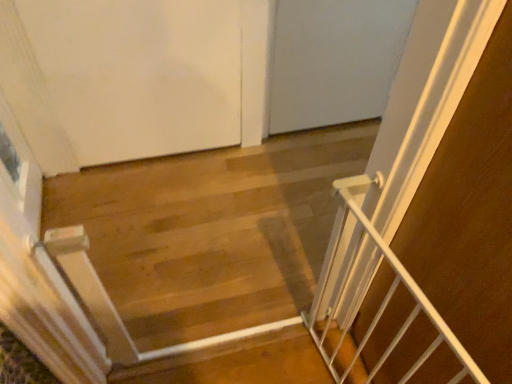
This screenshot has height=384, width=512. What do you see at coordinates (140, 73) in the screenshot? I see `white matte door at upper left` at bounding box center [140, 73].

Locate an element on the screen. white matte door at upper left is located at coordinates (140, 73).

This screenshot has height=384, width=512. Identify the location of white metal gate at right. (366, 292).

Find the location of a particular element. white matte door at upper left is located at coordinates (140, 73).

Considering the sizes of white matte door at upper left and white metal gate at center in the image, is white matte door at upper left taller or shorter than white metal gate at center?

Considering their sizes, white matte door at upper left has more height than white metal gate at center.

Image resolution: width=512 pixels, height=384 pixels. What are the coordinates of `stairwell on the right of white matte door at upper left` in the screenshot? It's located at (211, 232).

Looking at this image, how different are the orientations of white matte door at upper left and white metal gate at center in degrees?

The facing directions of white matte door at upper left and white metal gate at center are 0.723 degrees apart.

From the image's perspective, who appears lower, white matte door at upper left or white metal gate at center?

white metal gate at center, from the image's perspective.

Is white matte door at upper left oriented towards white metal gate at right?

Yes, white matte door at upper left is aimed at white metal gate at right.

Is white matte door at upper left not inside white metal gate at right?

white matte door at upper left lies outside white metal gate at right's area.

Does white matte door at upper left have a greater width compared to white metal gate at right?

No, white matte door at upper left is not wider than white metal gate at right.

Is white metal gate at right wider than white metal gate at center?

Yes, white metal gate at right is wider than white metal gate at center.

Who is more distant, white metal gate at right or white metal gate at center?

Positioned behind is white metal gate at center.

Considering the relative sizes of white metal gate at right and white metal gate at center in the image provided, is white metal gate at right bigger than white metal gate at center?

Yes, white metal gate at right is bigger than white metal gate at center.

From the image's perspective, would you say white metal gate at right is positioned over white metal gate at center?

No.

Is white metal gate at center positioned beyond the bounds of white matte door at upper left?

Yes, white metal gate at center is not within white matte door at upper left.

Is white metal gate at center looking in the opposite direction of white matte door at upper left?

Absolutely, white metal gate at center is directed away from white matte door at upper left.

How much distance is there between white metal gate at center and white matte door at upper left?

white metal gate at center and white matte door at upper left are 18.38 inches apart from each other.

The width and height of the screenshot is (512, 384). Find the location of `door lying above the white metal gate at center (from the image's perspective)`. door lying above the white metal gate at center (from the image's perspective) is located at coordinates (140, 73).

Would you say white metal gate at center contains white metal gate at right?

No, white metal gate at center does not contain white metal gate at right.

Considering the sizes of objects white metal gate at center and white metal gate at right in the image provided, who is bigger, white metal gate at center or white metal gate at right?

white metal gate at right is bigger.

In order to click on stairwell beneath the white metal gate at right (from a real-world perspective) in this screenshot , I will do `click(211, 232)`.

Could you tell me if white metal gate at right is facing white matte door at upper left?

No, white metal gate at right is not facing towards white matte door at upper left.

Considering the sizes of objects white metal gate at right and white matte door at upper left in the image provided, who is wider, white metal gate at right or white matte door at upper left?

Wider between the two is white metal gate at right.

Does point (403, 324) lie behind point (165, 53)?

No, it is not.

Does white metal gate at right touch white matte door at upper left?

No.

Find the location of a particular element. door located above the white metal gate at center (from the image's perspective) is located at coordinates (140, 73).

Where is `door above the white metal gate at right (from a real-world perspective)`? Image resolution: width=512 pixels, height=384 pixels. door above the white metal gate at right (from a real-world perspective) is located at coordinates (140, 73).

When comparing their distances from white metal gate at center, does white matte door at upper left or white metal gate at right seem closer?

The object closer to white metal gate at center is white matte door at upper left.

Which object lies nearer to the anchor point white metal gate at right, white metal gate at center or white matte door at upper left?

white metal gate at center is closer to white metal gate at right.

Looking at the image, which one is located further to white matte door at upper left, white metal gate at right or white metal gate at center?

Among the two, white metal gate at right is located further to white matte door at upper left.

Looking at the image, which one is located closer to white metal gate at right, white matte door at upper left or white metal gate at center?

white metal gate at center lies closer to white metal gate at right than the other object.

Based on their spatial positions, is white metal gate at right or white matte door at upper left further from white metal gate at center?

Based on the image, white metal gate at right appears to be further to white metal gate at center.

Estimate the real-world distances between objects in this image. Which object is further from white matte door at upper left, white metal gate at center or white metal gate at right?

A: The object further to white matte door at upper left is white metal gate at right.

Identify the location of stairwell between white matte door at upper left and white metal gate at right vertically. The width and height of the screenshot is (512, 384). (211, 232).